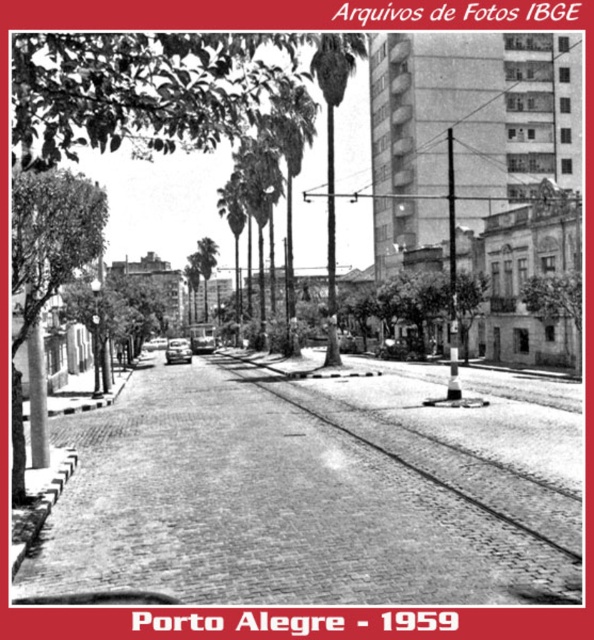
Does cobblestone train track at center have a larger size compared to shiny silver car at center?

Yes, cobblestone train track at center is bigger than shiny silver car at center.

Does point (418, 470) come farther from viewer compared to point (168, 355)?

No, (418, 470) is in front of (168, 355).

The image size is (594, 640). In order to click on cobblestone train track at center in this screenshot , I will do `click(387, 451)`.